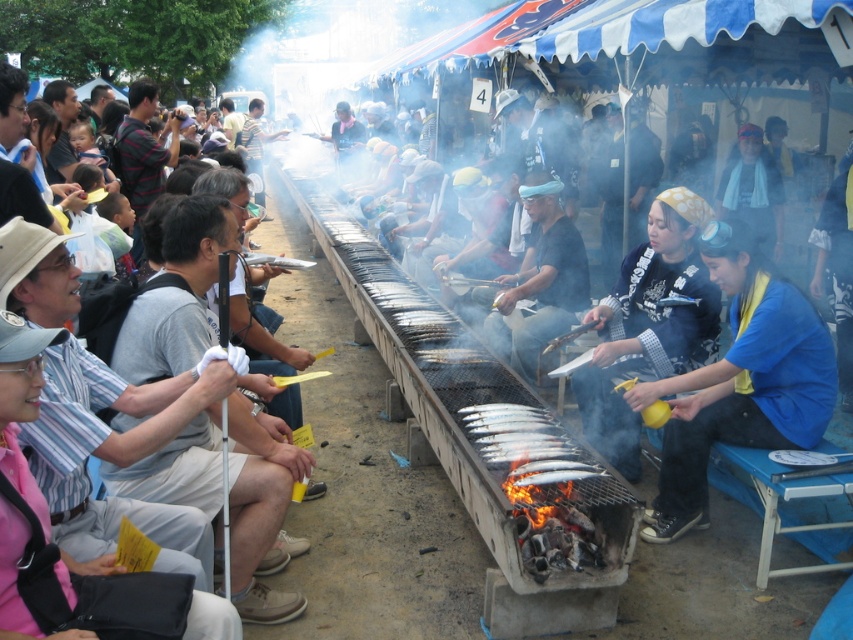
You are a photographer at the event and want to capture a photo that includes both the blue fabric shirt at lower right and the silver metallic fish at center. Based on their positions, which object should you position closer to the right side of your camera frame?

The blue fabric shirt at lower right should be positioned closer to the right side of your camera frame because it is located to the right of the silver metallic fish at center.

You are a photographer standing at the edge of the event area. You want to take a photo of the silver metallic fish at center without including the blue fabric shirt at lower right in the frame. Is this possible based on their positions?

The blue fabric shirt at lower right is positioned over the silver metallic fish at center, so taking a photo of the silver metallic fish at center without including the blue fabric shirt at lower right would not be possible as the shirt is covering part of the fish.

You are standing at point (259,481) and want to walk to the grill. However, there is an obstacle at point (749,316). Can you reach the grill without passing through the obstacle?

Point (749,316) is behind point (259,481), so you can reach the grill without passing through the obstacle.